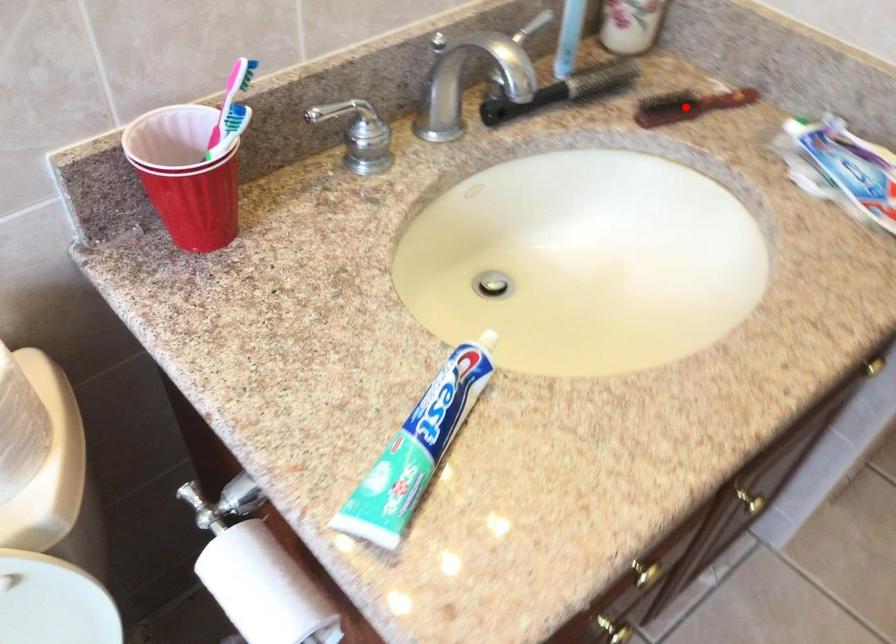
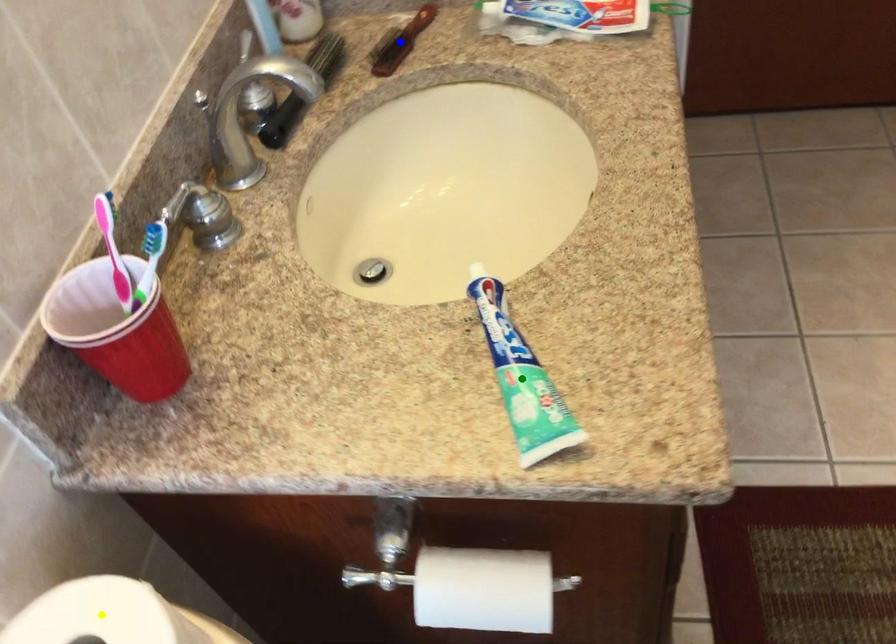
Question: I am providing you with two images of the same scene from different viewpoints. A red point is marked on the first image. You are given multiple points on the second image. In image 2, which mark is for the same physical point as the one in image 1?

Choices:
 (A) yellow point
 (B) green point
 (C) blue point

Answer: (C)